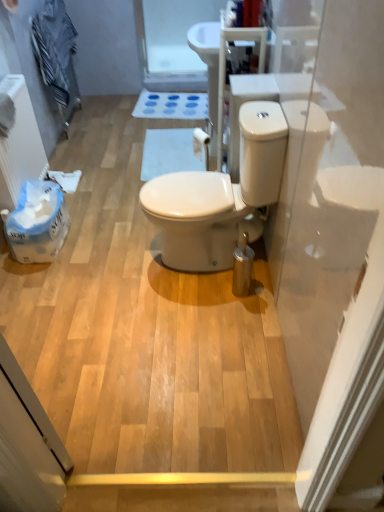
Question: Is white matte bath mat at center positioned with its back to striped cotton towel at upper left?

Choices:
 (A) no
 (B) yes

Answer: (A)

Question: Is white matte bath mat at center further to the viewer compared to striped cotton towel at upper left?

Choices:
 (A) no
 (B) yes

Answer: (B)

Question: Considering the relative positions of white matte bath mat at center and striped cotton towel at upper left in the image provided, is white matte bath mat at center in front of striped cotton towel at upper left?

Choices:
 (A) yes
 (B) no

Answer: (B)

Question: Can you confirm if white matte bath mat at center is positioned to the right of striped cotton towel at upper left?

Choices:
 (A) no
 (B) yes

Answer: (B)

Question: Does white matte bath mat at center have a greater width compared to striped cotton towel at upper left?

Choices:
 (A) no
 (B) yes

Answer: (B)

Question: Is white matte toilet paper at center taller or shorter than striped cotton towel at upper left?

Choices:
 (A) tall
 (B) short

Answer: (B)

Question: Is white matte toilet paper at center inside the boundaries of striped cotton towel at upper left, or outside?

Choices:
 (A) outside
 (B) inside

Answer: (A)

Question: Visually, is white matte toilet paper at center positioned to the left or to the right of striped cotton towel at upper left?

Choices:
 (A) right
 (B) left

Answer: (A)

Question: From the image's perspective, is white matte toilet paper at center positioned above or below striped cotton towel at upper left?

Choices:
 (A) below
 (B) above

Answer: (A)

Question: In terms of height, does white glossy toilet at center look taller or shorter compared to white matte bath mat at center?

Choices:
 (A) tall
 (B) short

Answer: (A)

Question: Considering their positions, is white glossy toilet at center located in front of or behind white matte bath mat at center?

Choices:
 (A) behind
 (B) front

Answer: (B)

Question: Looking at their shapes, would you say white glossy toilet at center is wider or thinner than white matte bath mat at center?

Choices:
 (A) wide
 (B) thin

Answer: (A)

Question: Based on their sizes in the image, would you say white glossy toilet at center is bigger or smaller than white matte bath mat at center?

Choices:
 (A) small
 (B) big

Answer: (B)

Question: From their relative heights in the image, would you say white matte toilet paper at center is taller or shorter than white matte bath mat at center?

Choices:
 (A) short
 (B) tall

Answer: (B)

Question: Is white matte toilet paper at center wider or thinner than white matte bath mat at center?

Choices:
 (A) wide
 (B) thin

Answer: (B)